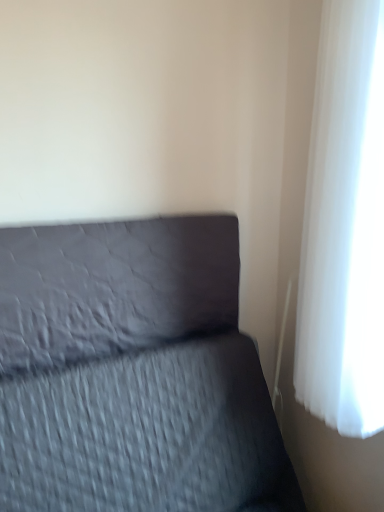
Question: Is matte gray pillow at center taller or shorter than textured gray bed at lower left?

Choices:
 (A) short
 (B) tall

Answer: (A)

Question: Is matte gray pillow at center in front of or behind textured gray bed at lower left in the image?

Choices:
 (A) front
 (B) behind

Answer: (B)

Question: Which object is the farthest from the textured gray bed at lower left?

Choices:
 (A) matte gray pillow at center
 (B) white sheer curtain at right

Answer: (B)

Question: Which is farther from the matte gray pillow at center?

Choices:
 (A) textured gray bed at lower left
 (B) white sheer curtain at right

Answer: (B)